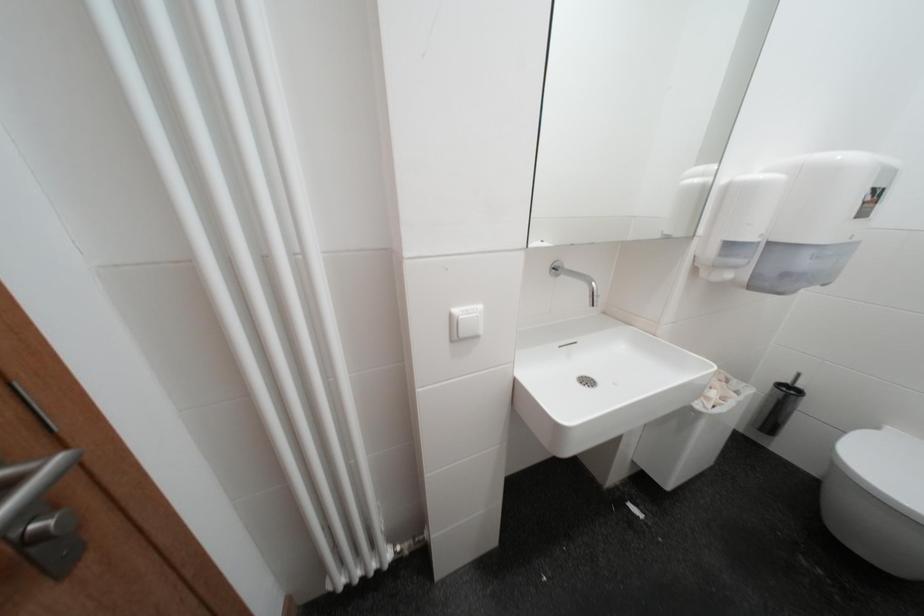
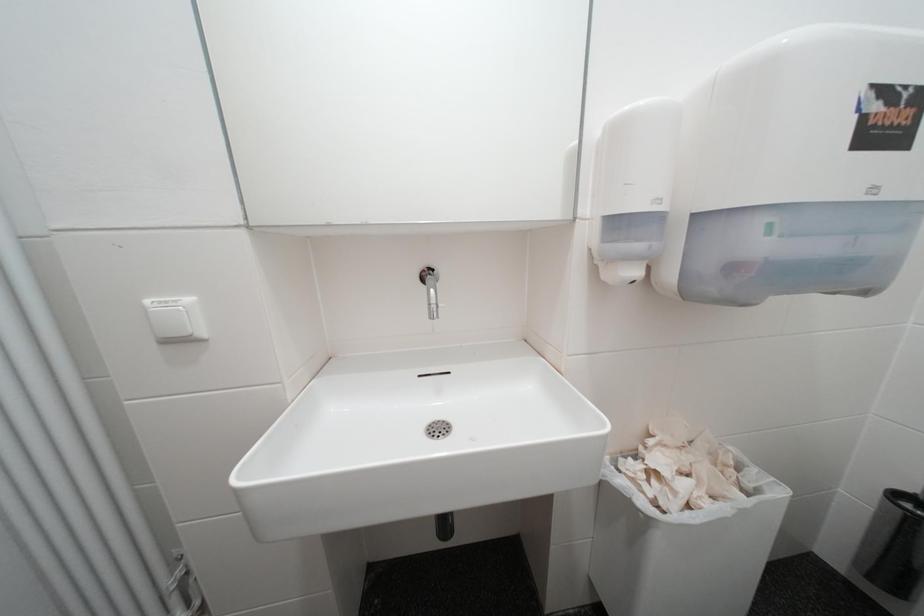
Question: How did the camera likely rotate?

Choices:
 (A) Left
 (B) Right
 (C) Up
 (D) Down

Answer: (A)